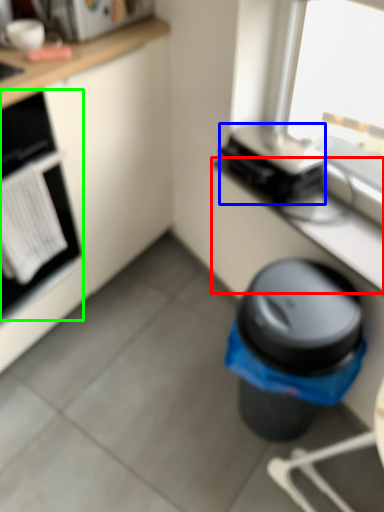
Question: Which object is positioned farthest from counter top (highlighted by a red box)? Select from appliance (highlighted by a blue box) and home appliance (highlighted by a green box).

Choices:
 (A) appliance
 (B) home appliance

Answer: (B)